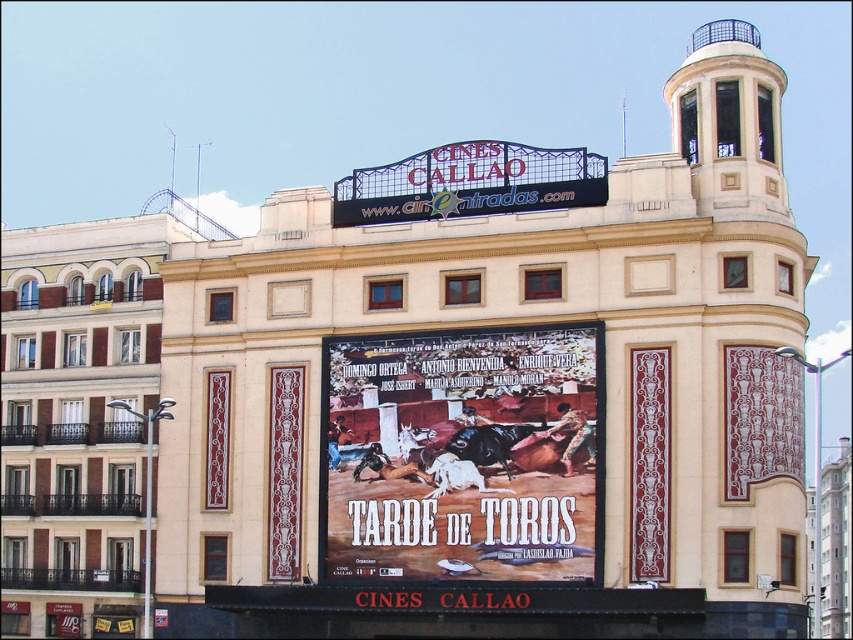
Looking at this image, you are an artist who wants to paint a replica of the scene. You need to know which object is taller between the matte poster at center and the metallic signboard at center. Which one should you paint first if you want to start with the taller one?

The matte poster at center is taller than the metallic signboard at center, so you should paint the matte poster at center first.

What object is located at the coordinates point (463, 456) in the scene?

The point (463, 456) corresponds to the matte poster at center.

From the picture: You are standing in front of the building and want to know which of the two points, point (476, 348) or point (454, 195), is closer to you. Can you determine this based on the scene?

Point (476, 348) is closer to the viewer than point (454, 195).